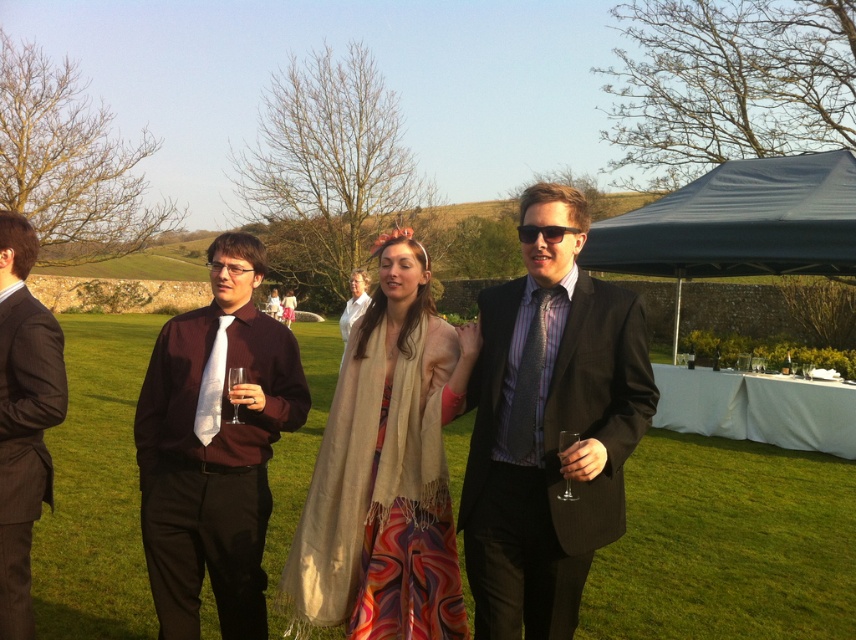
Measure the distance between multicolored silk dress at center and striped fabric tie at center.

multicolored silk dress at center and striped fabric tie at center are 19.24 inches apart.

Can you confirm if multicolored silk dress at center is thinner than striped fabric tie at center?

No.

Where is `multicolored silk dress at center`? Image resolution: width=856 pixels, height=640 pixels. multicolored silk dress at center is located at coordinates (409, 576).

Locate an element on the screen. multicolored silk dress at center is located at coordinates (409, 576).

Is point (658, 435) farther from camera compared to point (545, 544)?

Yes, point (658, 435) is behind point (545, 544).

From the picture: Which of these two, green grass at center or matte black suit at center, stands taller?

matte black suit at center is taller.

Locate an element on the screen. This screenshot has height=640, width=856. green grass at center is located at coordinates (727, 545).

Which is behind, point (627, 532) or point (542, 317)?

The point (627, 532) is more distant.

Does green grass at center have a lesser width compared to striped fabric tie at center?

Incorrect, green grass at center's width is not less than striped fabric tie at center's.

Between point (789, 538) and point (535, 317), which one is positioned in front?

Point (535, 317) is more forward.

The height and width of the screenshot is (640, 856). Find the location of `green grass at center`. green grass at center is located at coordinates (727, 545).